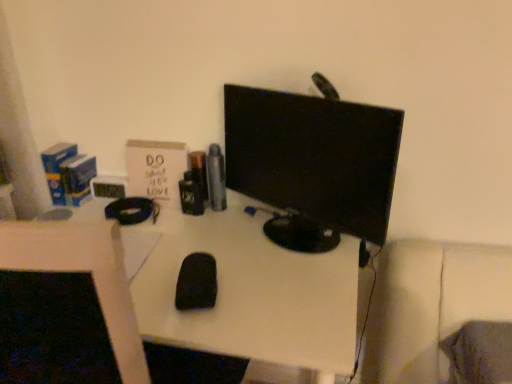
At what (x,y) coordinates should I click in order to perform the action: click on blank space situated above black matte mouse at center (from a real-world perspective). Please return your answer as a coordinate pair (x, y). Looking at the image, I should click on (204, 251).